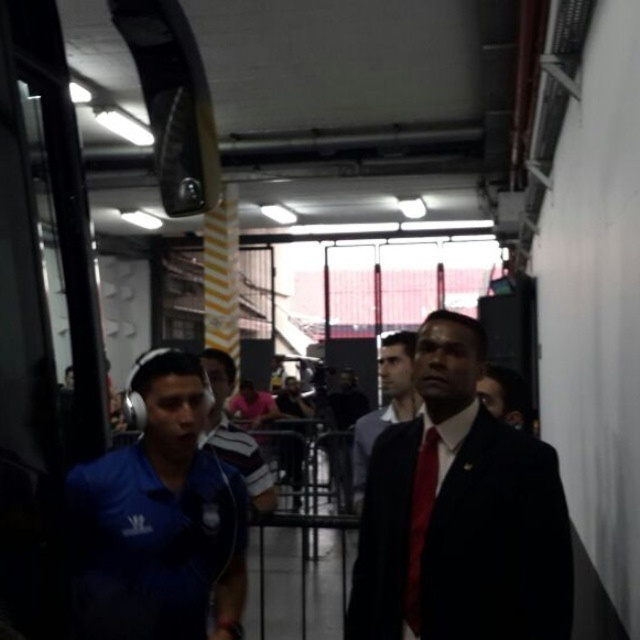
Can you confirm if blue fabric shirt at left is wider than dark blue suit at center?

Correct, the width of blue fabric shirt at left exceeds that of dark blue suit at center.

Is blue fabric shirt at left to the right of dark blue suit at center from the viewer's perspective?

In fact, blue fabric shirt at left is to the left of dark blue suit at center.

The image size is (640, 640). In order to click on blue fabric shirt at left in this screenshot , I will do `click(157, 522)`.

Between point (480, 598) and point (204, 492), which one is positioned behind?

The point (204, 492) is behind.

Is dark suit at center shorter than blue fabric shirt at left?

No, dark suit at center is not shorter than blue fabric shirt at left.

Is point (556, 497) farther from camera compared to point (161, 636)?

Yes, it is.

Locate an element on the screen. The height and width of the screenshot is (640, 640). dark suit at center is located at coordinates (460, 513).

Does blue fabric shirt at left have a lesser width compared to red silk tie at center?

No.

Based on the photo, which is more to the left, blue fabric shirt at left or red silk tie at center?

blue fabric shirt at left

This screenshot has height=640, width=640. Find the location of `blue fabric shirt at left`. blue fabric shirt at left is located at coordinates (157, 522).